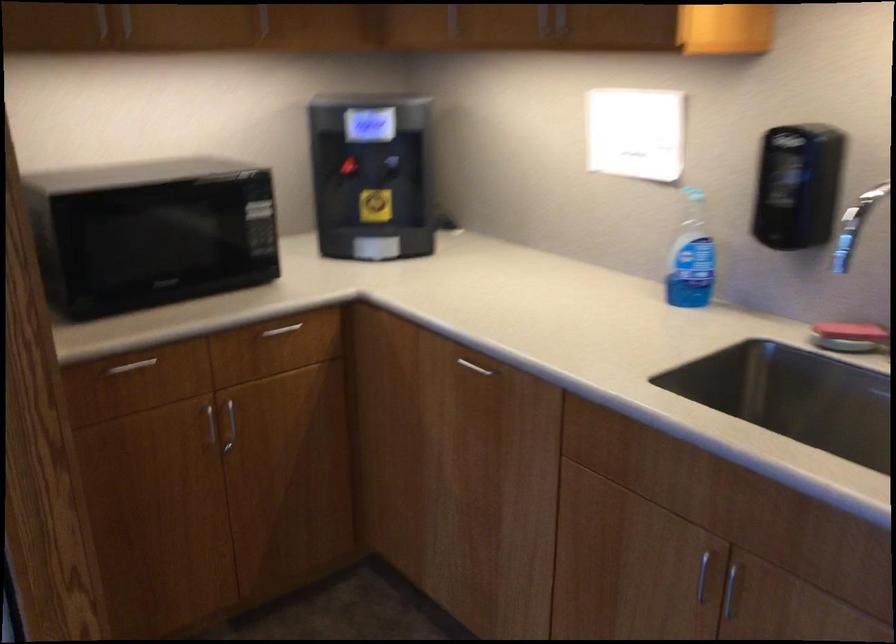
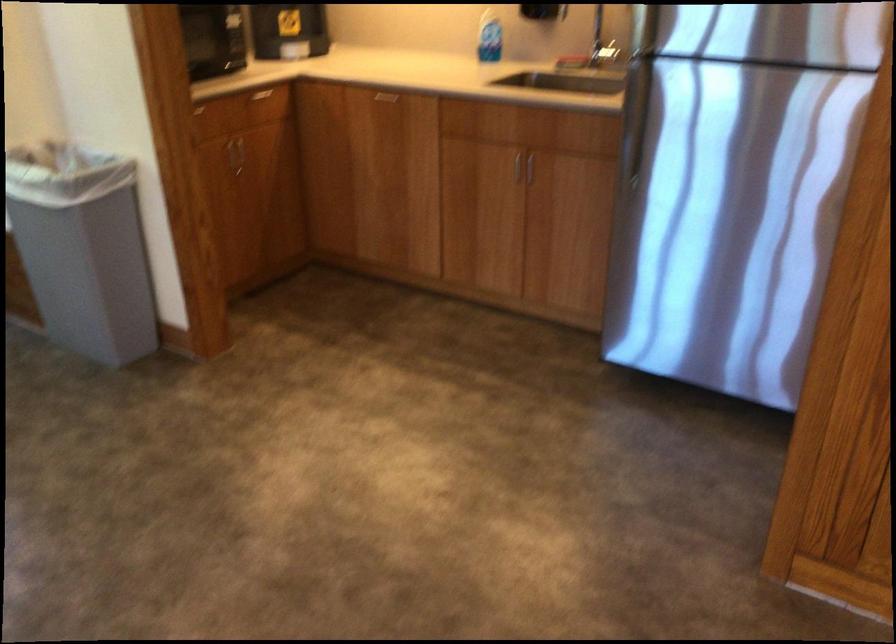
The point at (703, 565) is marked in the first image. Where is the corresponding point in the second image?

(515, 165)